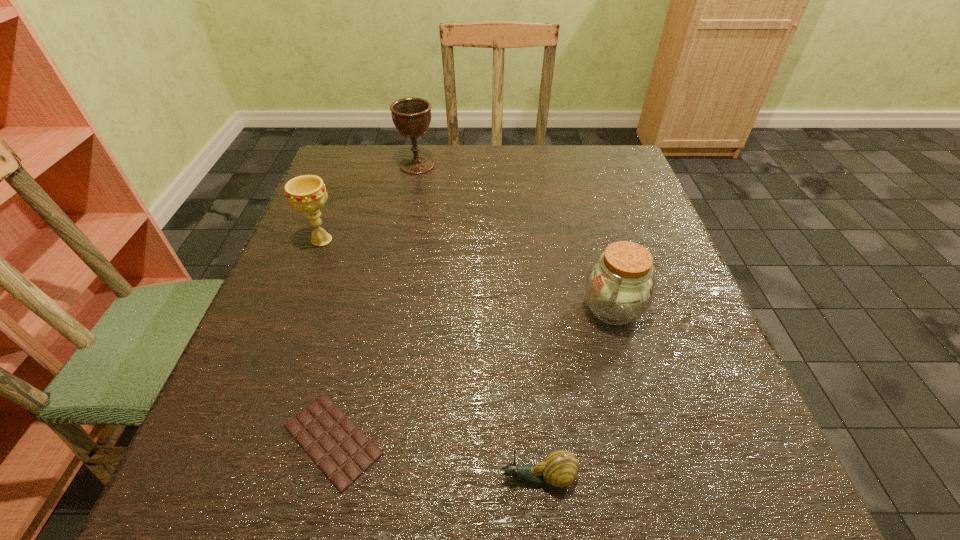
Locate which object is the fourth closest to the farthest object. Please provide its 2D coordinates. Your answer should be formatted as a tuple, i.e. [(x, y)], where the tuple contains the x and y coordinates of a point satisfying the conditions above.

[(559, 469)]

What are the coordinates of `free space in the image that satisfies the following two spatial constraints: 1. on the front side of the third nearest object; 2. on the left side of the leftmost object` in the screenshot? It's located at (295, 309).